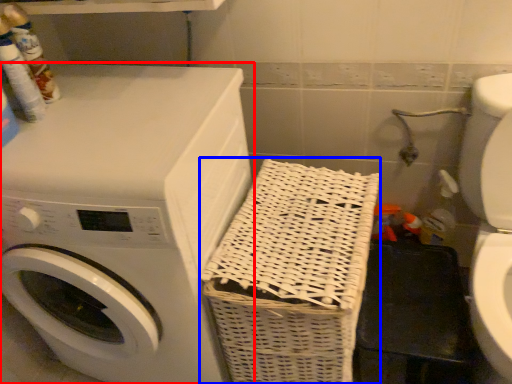
Question: Among these objects, which one is farthest to the camera, washing machine (highlighted by a red box) or basket (highlighted by a blue box)?

Choices:
 (A) washing machine
 (B) basket

Answer: (B)